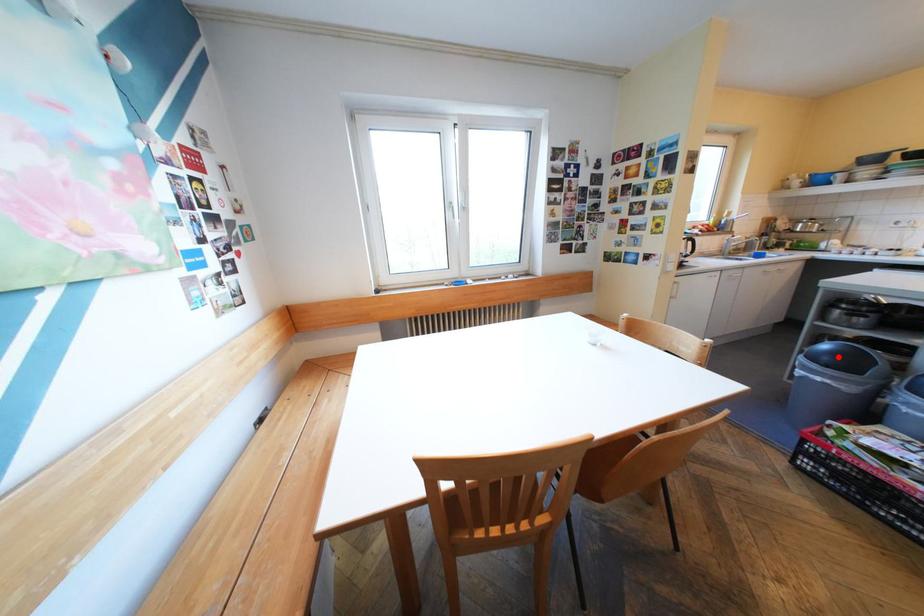
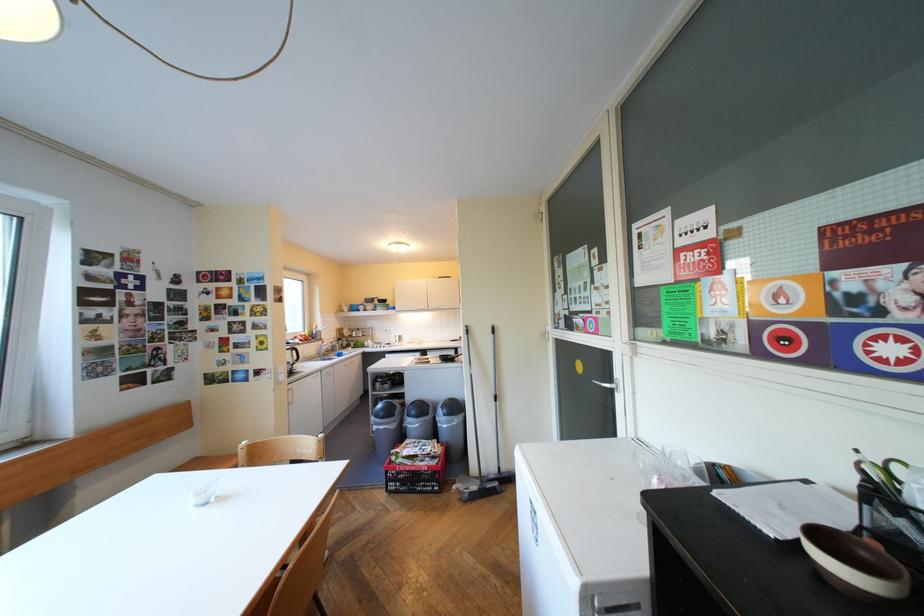
Question: I am providing you with two images of the same scene from different viewpoints. Image1 has a red point marked. In image2, the corresponding 3D location appears at what relative position? Reply with the corresponding letter.

Choices:
 (A) Closer
 (B) Farther

Answer: (B)